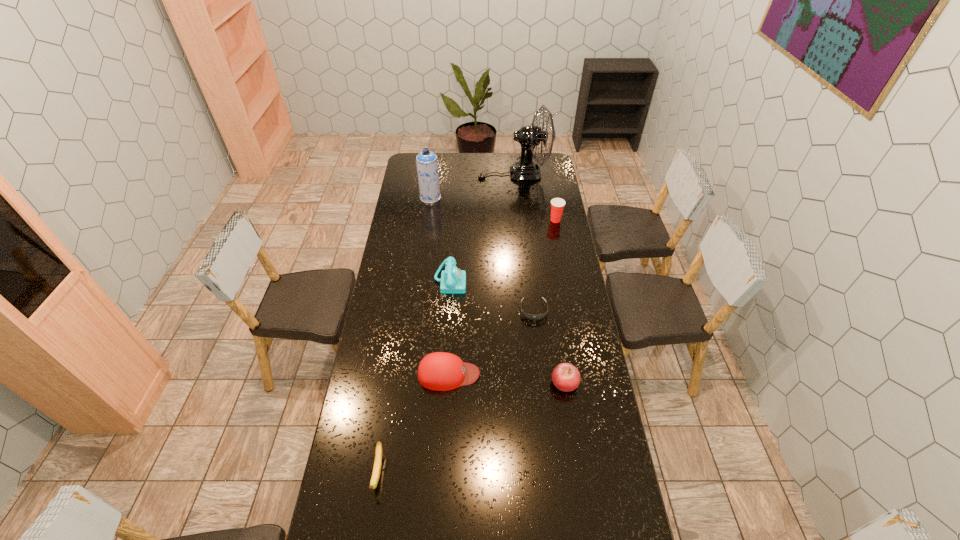
This screenshot has height=540, width=960. Identify the location of the farthest object. pos(529,136).

At what (x,y) coordinates should I click in order to perform the action: click on the tallest object. Please return your answer as a coordinate pair (x, y). Looking at the image, I should click on (529, 136).

Where is `the seventh shortest object`? This screenshot has width=960, height=540. the seventh shortest object is located at coordinates (426, 161).

You are a GUI agent. You are given a task and a screenshot of the screen. Output one action in this format:
    pyautogui.click(x=<x>, y=<y>)
    Task: Click on the seventh nearest object
    
    Given the screenshot: What is the action you would take?
    pyautogui.click(x=426, y=161)

Identify the location of telephone. (453, 280).

Identify the location of the sixth nearest object. (557, 204).

The height and width of the screenshot is (540, 960). Identify the location of baseball cap. (439, 371).

Image resolution: width=960 pixels, height=540 pixels. Find the location of `apple`. apple is located at coordinates (565, 376).

Where is `banana`? This screenshot has width=960, height=540. banana is located at coordinates (378, 452).

This screenshot has width=960, height=540. I want to click on the nearest object, so click(378, 452).